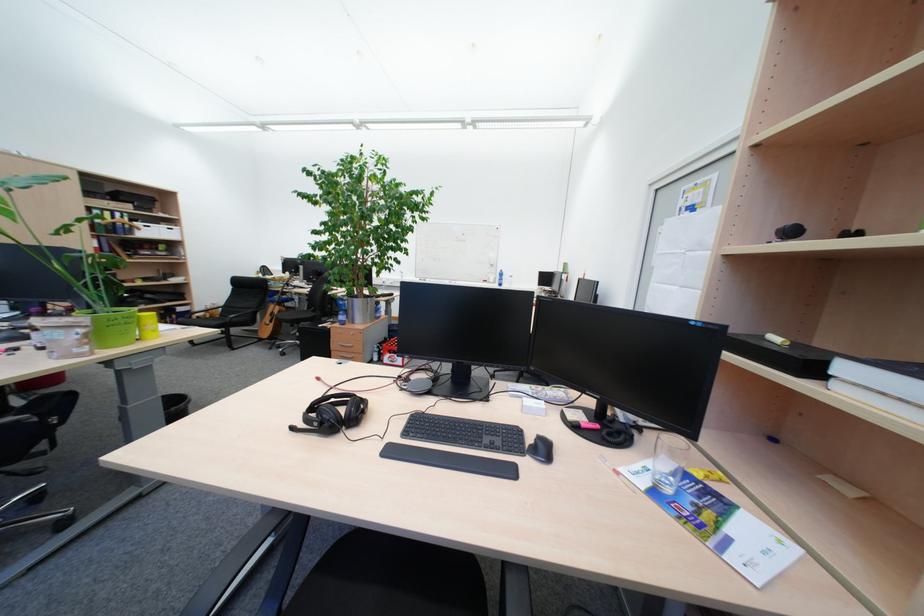
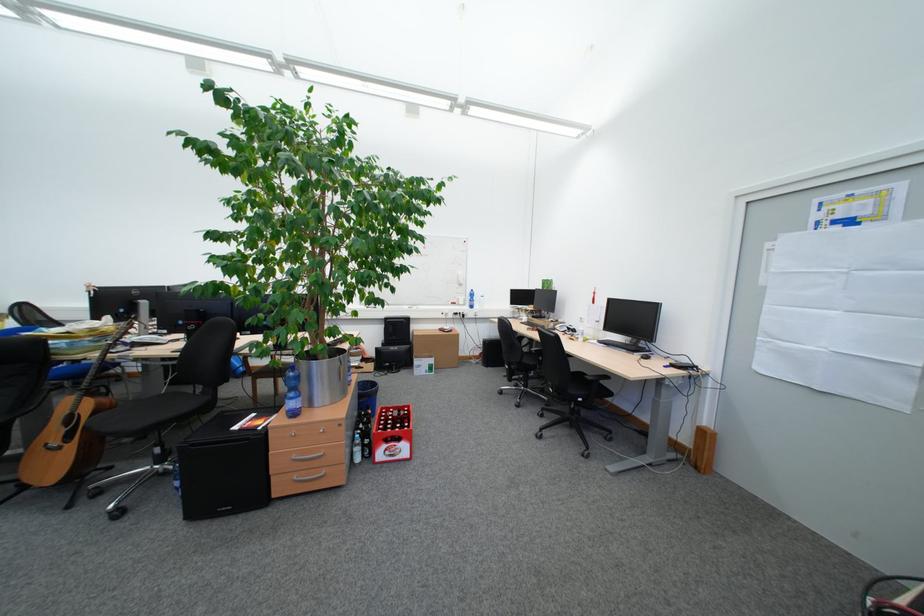
Where in the second image is the point corresponding to (402,353) from the first image?

(398, 442)